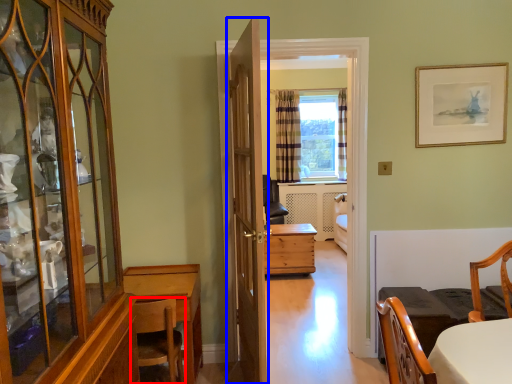
Question: Which point is closer to the camera, chair (highlighted by a red box) or door (highlighted by a blue box)?

Choices:
 (A) chair
 (B) door

Answer: (B)